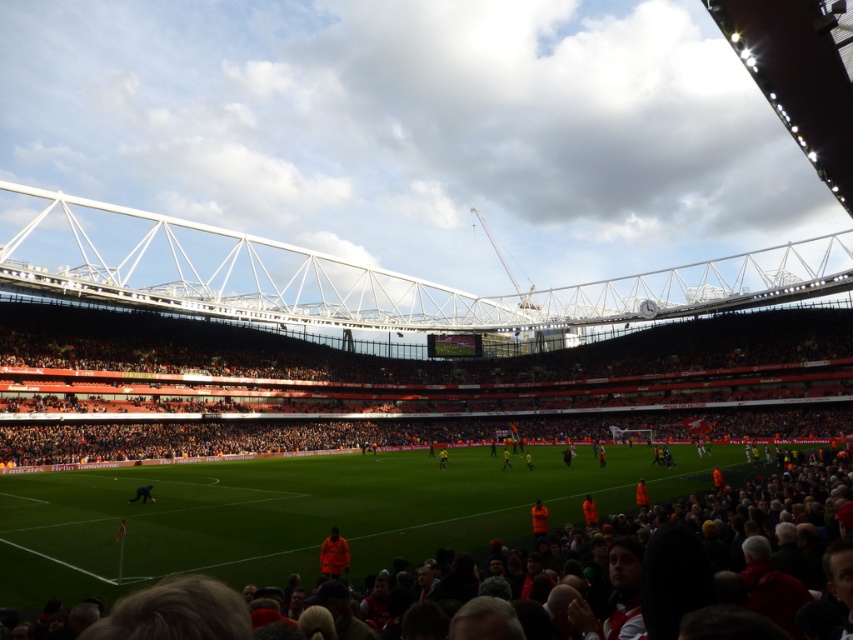
Question: Which object is the farthest from the yellow jersey at center?

Choices:
 (A) green grass football field at center
 (B) orange fabric person at center
 (C) dark blue fabric at center
 (D) orange fabric jacket at lower center

Answer: (B)

Question: Among these objects, which one is nearest to the camera?

Choices:
 (A) yellow jersey at center
 (B) orange fabric person at center
 (C) green grass football field at center

Answer: (C)

Question: Does orange fabric jacket at lower center have a smaller size compared to yellow jersey at center?

Choices:
 (A) no
 (B) yes

Answer: (B)

Question: Considering the real-world distances, which object is farthest from the green grass football field at center?

Choices:
 (A) yellow uniform at center
 (B) dark blue fabric at center
 (C) orange fabric jacket at lower center

Answer: (A)

Question: Is orange fabric jacket at lower center below dark blue fabric at center?

Choices:
 (A) no
 (B) yes

Answer: (A)

Question: Does orange fabric person at center appear under yellow uniform at center?

Choices:
 (A) yes
 (B) no

Answer: (B)